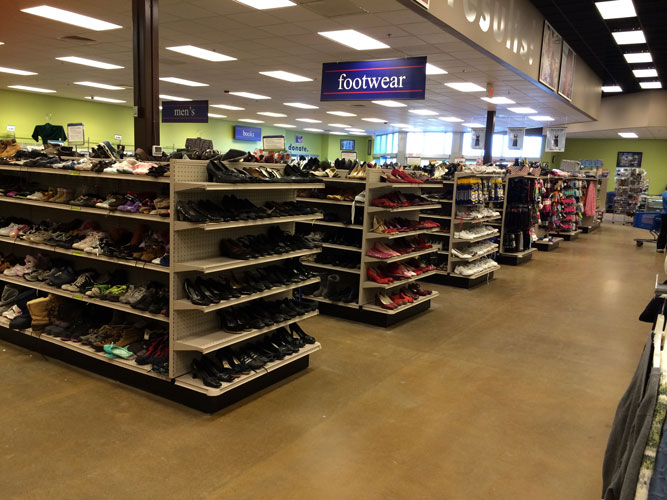
What are the coordinates of `wall` in the screenshot? It's located at (111, 117).